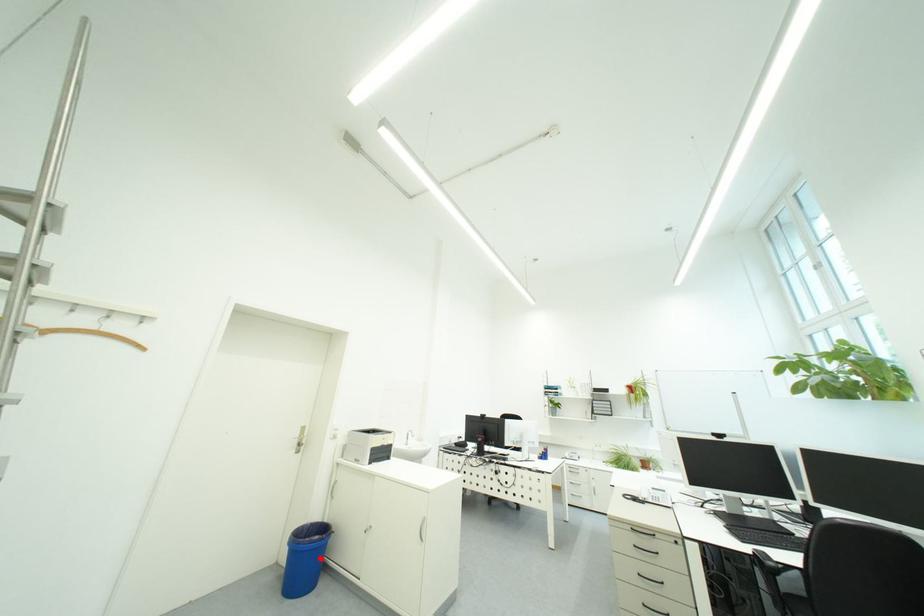
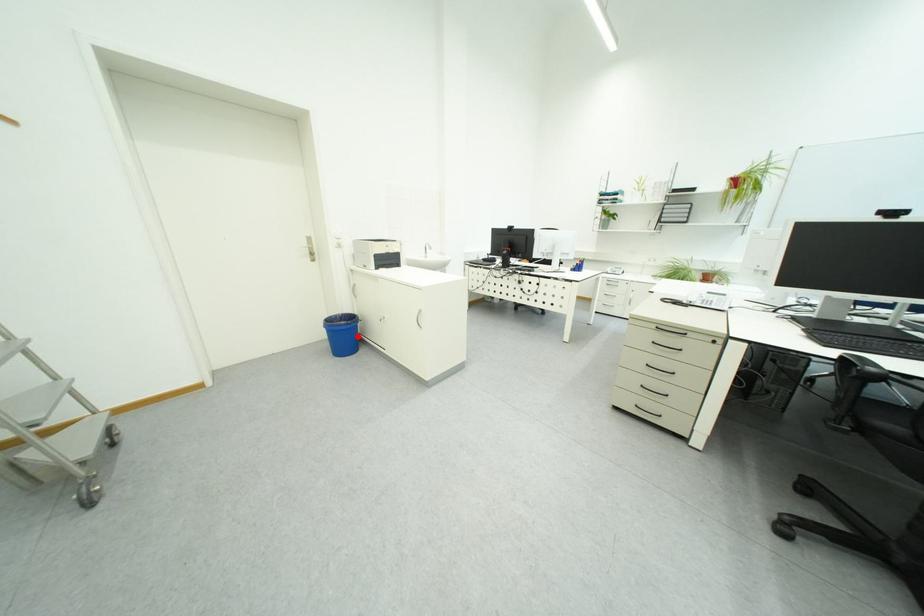
I am providing you with two images of the same scene from different viewpoints. A red point is marked on the first image and another point is marked on the second image. Does the point marked in image1 correspond to the same location as the one in image2?

Yes